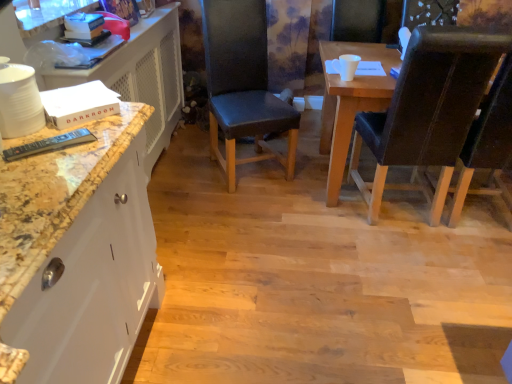
Describe the element at coordinates (141, 76) in the screenshot. The width and height of the screenshot is (512, 384). I see `marble/dark brown dresser at left` at that location.

Measure the distance between point (415, 58) and camera.

Point (415, 58) and camera are 6.05 feet apart.

From the picture: What is the approximate height of black leather chair at center, which is the 1th chair in left-to-right order?

1.11 meters.

Identify the location of marble/dark brown dresser at left. (141, 76).

Can you confirm if black leather chair at right, the 2th chair viewed from the left, is thinner than black leather chair at center, which is the 1th chair in left-to-right order?

No, black leather chair at right, the 2th chair viewed from the left, is not thinner than black leather chair at center, which is the 1th chair in left-to-right order.

Is black leather chair at right, which is the second chair in right-to-left order, smaller than black leather chair at center, which is the 1th chair in left-to-right order?

Incorrect, black leather chair at right, which is the second chair in right-to-left order, is not smaller in size than black leather chair at center, which is the 1th chair in left-to-right order.

You are a GUI agent. You are given a task and a screenshot of the screen. Output one action in this format:
    pyautogui.click(x=<x>, y=<y>)
    Task: Click on the chair on the left of black leather chair at right, the 2th chair viewed from the left
    Image resolution: width=512 pixels, height=384 pixels.
    Given the screenshot: What is the action you would take?
    pyautogui.click(x=243, y=85)

Is black leather chair at right, which is the second chair in right-to-left order, closer to camera compared to black leather chair at center, the third chair from the right?

Yes, black leather chair at right, which is the second chair in right-to-left order, is in front of black leather chair at center, the third chair from the right.

Is marble/dark brown dresser at left not close to black leather chair at center, the third chair from the right?

No, marble/dark brown dresser at left is not far away from black leather chair at center, the third chair from the right.

Considering the relative sizes of marble/dark brown dresser at left and black leather chair at center, which is the 1th chair in left-to-right order, in the image provided, is marble/dark brown dresser at left smaller than black leather chair at center, which is the 1th chair in left-to-right order,?

Incorrect, marble/dark brown dresser at left is not smaller in size than black leather chair at center, which is the 1th chair in left-to-right order.

Is marble/dark brown dresser at left inside the boundaries of black leather chair at center, which is the 1th chair in left-to-right order, or outside?

marble/dark brown dresser at left is spatially situated outside black leather chair at center, which is the 1th chair in left-to-right order.

Does marble/dark brown dresser at left lie behind black leather chair at center, the third chair from the right?

No, marble/dark brown dresser at left is closer to the camera.

Is black leather chair at center, the third chair from the right, in contact with dark brown leather chair at right, arranged as the 3th chair when viewed from the left?

No, black leather chair at center, the third chair from the right, is not making contact with dark brown leather chair at right, arranged as the 3th chair when viewed from the left.

Is dark brown leather chair at right, placed as the 1th chair when sorted from right to left, at the back of black leather chair at center, the third chair from the right?

black leather chair at center, the third chair from the right, is not turned away from dark brown leather chair at right, placed as the 1th chair when sorted from right to left.

Is black leather chair at center, which is the 1th chair in left-to-right order, located outside dark brown leather chair at right, arranged as the 3th chair when viewed from the left?

Yes, black leather chair at center, which is the 1th chair in left-to-right order, is not within dark brown leather chair at right, arranged as the 3th chair when viewed from the left.

Based on the photo, can you confirm if black leather chair at center, the third chair from the right, is wider than dark brown leather chair at right, arranged as the 3th chair when viewed from the left?

In fact, black leather chair at center, the third chair from the right, might be narrower than dark brown leather chair at right, arranged as the 3th chair when viewed from the left.

Can you confirm if dark brown leather chair at right, arranged as the 3th chair when viewed from the left, is shorter than black leather chair at right, which is the second chair in right-to-left order?

Indeed, dark brown leather chair at right, arranged as the 3th chair when viewed from the left, has a lesser height compared to black leather chair at right, which is the second chair in right-to-left order.

The width and height of the screenshot is (512, 384). Find the location of `chair in front of the black leather chair at right, which is the second chair in right-to-left order`. chair in front of the black leather chair at right, which is the second chair in right-to-left order is located at coordinates (488, 147).

Is dark brown leather chair at right, placed as the 1th chair when sorted from right to left, next to black leather chair at right, which is the second chair in right-to-left order?

They are not placed beside each other.

What are the coordinates of `chair that is the 2nd one when counting forward from the black leather chair at center, which is the 1th chair in left-to-right order` in the screenshot? It's located at (x=488, y=147).

Considering the relative sizes of dark brown leather chair at right, placed as the 1th chair when sorted from right to left, and black leather chair at center, the third chair from the right, in the image provided, is dark brown leather chair at right, placed as the 1th chair when sorted from right to left, bigger than black leather chair at center, the third chair from the right,?

Yes.

Considering the positions of points (509, 87) and (204, 0), is point (509, 87) closer to camera compared to point (204, 0)?

Yes.

From a real-world perspective, is black leather chair at right, the 2th chair viewed from the left, physically located above or below marble/dark brown dresser at left?

In terms of real-world spatial position, black leather chair at right, the 2th chair viewed from the left, is above marble/dark brown dresser at left.

Are black leather chair at right, which is the second chair in right-to-left order, and marble/dark brown dresser at left making contact?

There is a gap between black leather chair at right, which is the second chair in right-to-left order, and marble/dark brown dresser at left.

Is point (460, 104) less distant than point (161, 38)?

Yes.

Does dark brown leather chair at right, arranged as the 3th chair when viewed from the left, turn towards marble/dark brown dresser at left?

No, dark brown leather chair at right, arranged as the 3th chair when viewed from the left, is not aimed at marble/dark brown dresser at left.

How many degrees apart are the facing directions of dark brown leather chair at right, arranged as the 3th chair when viewed from the left, and marble/dark brown dresser at left?

They differ by 90.4 degrees in their facing directions.

Is dark brown leather chair at right, placed as the 1th chair when sorted from right to left, positioned far away from marble/dark brown dresser at left?

That's right, there is a large distance between dark brown leather chair at right, placed as the 1th chair when sorted from right to left, and marble/dark brown dresser at left.

How far apart are dark brown leather chair at right, arranged as the 3th chair when viewed from the left, and marble/dark brown dresser at left?

dark brown leather chair at right, arranged as the 3th chair when viewed from the left, is 6.19 feet away from marble/dark brown dresser at left.

From the black leather chair at center, the third chair from the right, count 1st chair to the right and point to it. Please provide its 2D coordinates.

[(428, 111)]

Find the location of a particular element. The height and width of the screenshot is (384, 512). the 2nd chair directly above the marble/dark brown dresser at left (from a real-world perspective) is located at coordinates (243, 85).

Based on the photo, estimate the real-world distances between objects in this image. Which object is closer to dark brown leather chair at right, placed as the 1th chair when sorted from right to left, black leather chair at center, the third chair from the right, or black leather chair at right, the 2th chair viewed from the left?

black leather chair at right, the 2th chair viewed from the left, is closer to dark brown leather chair at right, placed as the 1th chair when sorted from right to left.

Consider the image. Which object lies further to the anchor point black leather chair at center, the third chair from the right, marble/dark brown dresser at left or black leather chair at right, the 2th chair viewed from the left?

black leather chair at right, the 2th chair viewed from the left, is positioned further to the anchor black leather chair at center, the third chair from the right.

When comparing their distances from black leather chair at right, which is the second chair in right-to-left order, does marble/dark brown dresser at left or dark brown leather chair at right, arranged as the 3th chair when viewed from the left, seem further?

marble/dark brown dresser at left is further to black leather chair at right, which is the second chair in right-to-left order.

Estimate the real-world distances between objects in this image. Which object is closer to marble/dark brown dresser at left, black leather chair at right, which is the second chair in right-to-left order, or dark brown leather chair at right, placed as the 1th chair when sorted from right to left?

Among the two, black leather chair at right, which is the second chair in right-to-left order, is located nearer to marble/dark brown dresser at left.

In the scene shown: Which object lies nearer to the anchor point marble/dark brown dresser at left, dark brown leather chair at right, arranged as the 3th chair when viewed from the left, or black leather chair at right, which is the second chair in right-to-left order?

black leather chair at right, which is the second chair in right-to-left order, lies closer to marble/dark brown dresser at left than the other object.

From the image, which object appears to be nearer to dark brown leather chair at right, placed as the 1th chair when sorted from right to left, marble/dark brown dresser at left or black leather chair at right, which is the second chair in right-to-left order?

The object closer to dark brown leather chair at right, placed as the 1th chair when sorted from right to left, is black leather chair at right, which is the second chair in right-to-left order.

In the scene shown: Estimate the real-world distances between objects in this image. Which object is further from black leather chair at center, the third chair from the right, black leather chair at right, which is the second chair in right-to-left order, or marble/dark brown dresser at left?

black leather chair at right, which is the second chair in right-to-left order, is further to black leather chair at center, the third chair from the right.

Which object lies nearer to the anchor point black leather chair at right, which is the second chair in right-to-left order, marble/dark brown dresser at left or black leather chair at center, the third chair from the right?

black leather chair at center, the third chair from the right, is closer to black leather chair at right, which is the second chair in right-to-left order.

Find the location of a particular element. The width and height of the screenshot is (512, 384). chair between black leather chair at center, the third chair from the right, and dark brown leather chair at right, arranged as the 3th chair when viewed from the left, in the horizontal direction is located at coordinates (428, 111).

Identify the location of chair between marble/dark brown dresser at left and black leather chair at right, the 2th chair viewed from the left, from left to right. (243, 85).